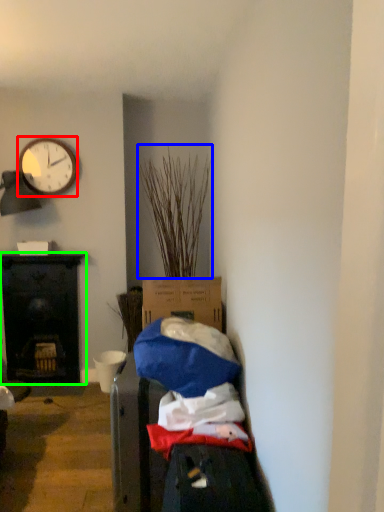
Question: Based on their relative distances, which object is nearer to clock (highlighted by a red box)? Choose from plant (highlighted by a blue box) and desk (highlighted by a green box).

Choices:
 (A) plant
 (B) desk

Answer: (A)